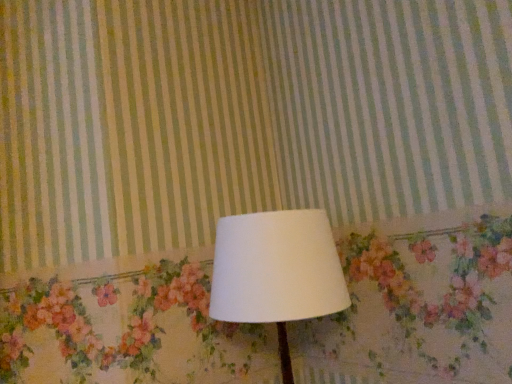
The image size is (512, 384). Describe the element at coordinates (276, 272) in the screenshot. I see `white fabric lampshade at center` at that location.

Where is `white fabric lampshade at center`? Image resolution: width=512 pixels, height=384 pixels. white fabric lampshade at center is located at coordinates pyautogui.click(x=276, y=272).

Where is `white fabric lampshade at center`? white fabric lampshade at center is located at coordinates (276, 272).